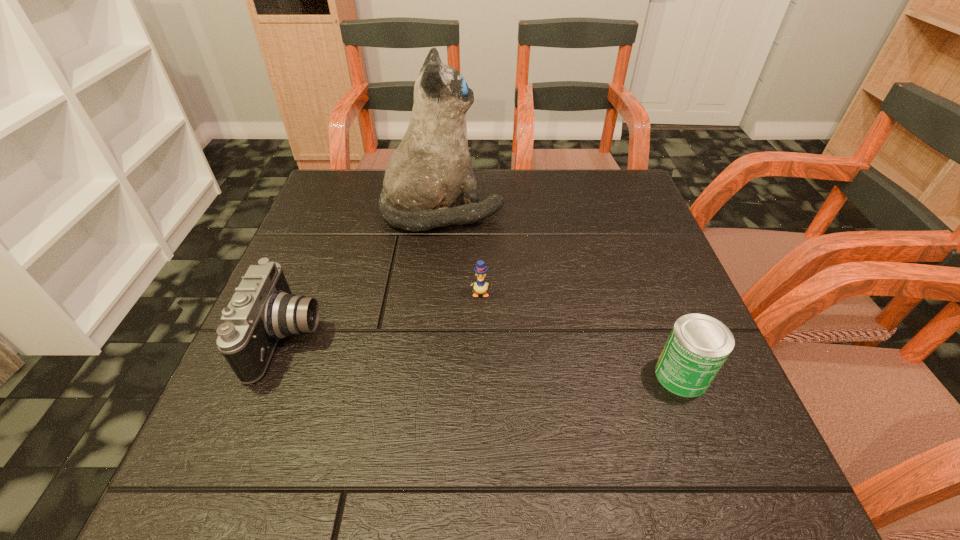
Where is `vacant space at the near right corner of the desktop`? The image size is (960, 540). vacant space at the near right corner of the desktop is located at coordinates (696, 465).

The width and height of the screenshot is (960, 540). What are the coordinates of `blank region between the rightmost object and the second tallest object` in the screenshot? It's located at (485, 356).

Find the location of `vacant region between the second shortest object and the third shortest object`. vacant region between the second shortest object and the third shortest object is located at coordinates (485, 356).

You are a GUI agent. You are given a task and a screenshot of the screen. Output one action in this format:
    pyautogui.click(x=<x>, y=<y>)
    Task: Click on the blank region between the camera and the cat
    This screenshot has height=540, width=960.
    Given the screenshot: What is the action you would take?
    pyautogui.click(x=366, y=274)

Identify the location of empty location between the tallest object and the leftmost object. The image size is (960, 540). (366, 274).

You are a GUI agent. You are given a task and a screenshot of the screen. Output one action in this format:
    pyautogui.click(x=<x>, y=<y>)
    Task: Click on the free space between the third shortest object and the tallest object
    Image resolution: width=960 pixels, height=540 pixels.
    Given the screenshot: What is the action you would take?
    pyautogui.click(x=366, y=274)

Find the location of `free area in between the third tallest object and the farthest object`. free area in between the third tallest object and the farthest object is located at coordinates (563, 293).

Where is `unoccupied area between the camera and the cat`? The width and height of the screenshot is (960, 540). unoccupied area between the camera and the cat is located at coordinates (366, 274).

Identify the location of empty space between the duckling and the can. (581, 334).

Where is `vacant point located between the third tallest object and the duckling`? vacant point located between the third tallest object and the duckling is located at coordinates (581, 334).